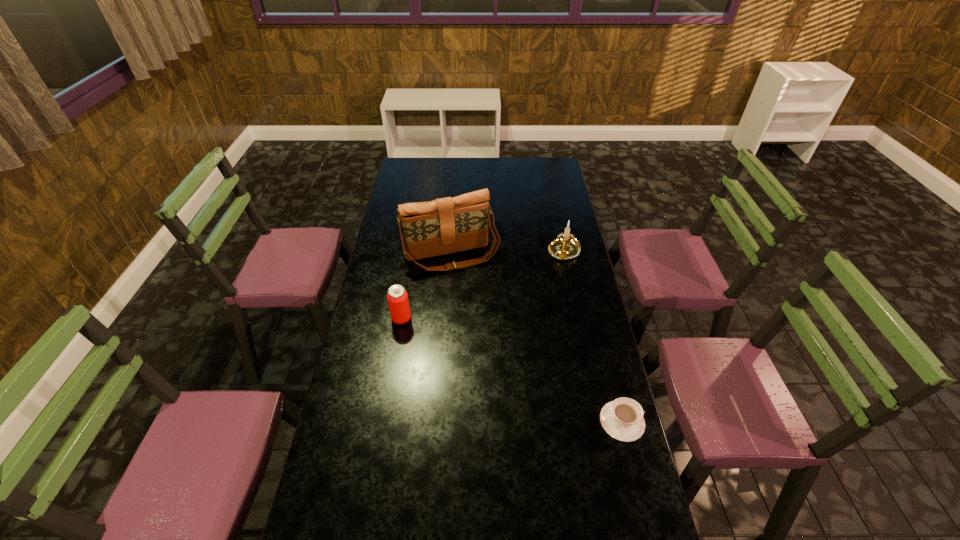
The image size is (960, 540). In order to click on beer can in this screenshot , I will do `click(397, 296)`.

At what (x,y) coordinates should I click in order to perform the action: click on the shortest object. Please return your answer as a coordinate pair (x, y). The height and width of the screenshot is (540, 960). Looking at the image, I should click on (622, 419).

Where is `the nearest object`? This screenshot has height=540, width=960. the nearest object is located at coordinates (622, 419).

Where is `the tallest object`? Image resolution: width=960 pixels, height=540 pixels. the tallest object is located at coordinates (447, 225).

Identify the location of candle holder. 565,246.

Find the location of `free region located on the right of the beer can`. free region located on the right of the beer can is located at coordinates (514, 319).

Image resolution: width=960 pixels, height=540 pixels. I want to click on vacant space situated 0.200m on the front-facing side of the shoulder bag, so click(478, 307).

At what (x,y) coordinates should I click in order to perform the action: click on vacant point located 0.400m on the front-facing side of the shoulder bag. Please return your answer as a coordinate pair (x, y). The image size is (960, 540). Looking at the image, I should click on (494, 346).

I want to click on vacant position located on the front-facing side of the shoulder bag, so click(481, 312).

Find the location of `vacant area situated on the handle side of the candle holder`. vacant area situated on the handle side of the candle holder is located at coordinates (513, 315).